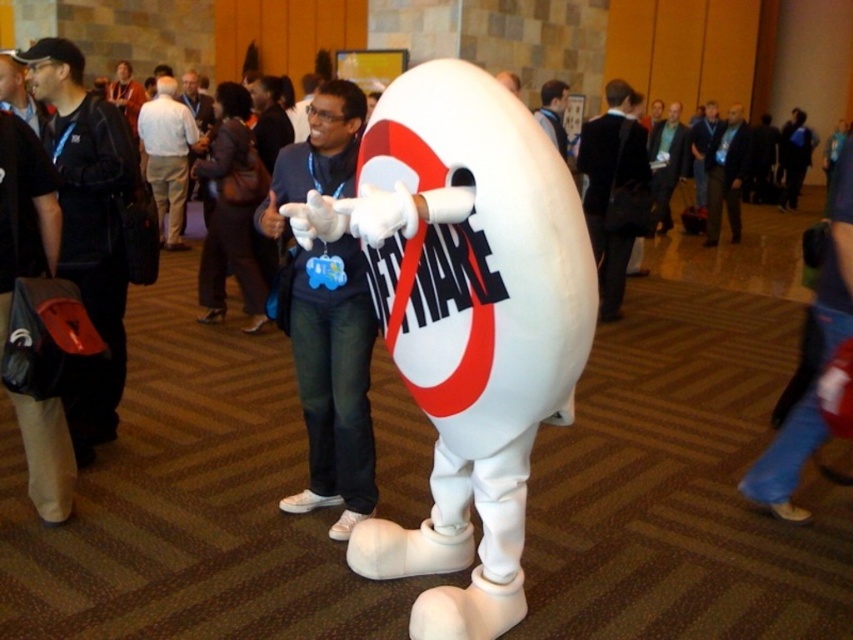
From the picture: You are standing in the conference hall and see two points marked in the scene. Which point is closer to you, point (334, 336) or point (723, 122)?

Point (334, 336) is closer to the viewer than point (723, 122).

You are standing in the conference hall and see two points marked in the scene. Which point, point (115, 150) or point (660, 227), is nearer to you?

Point (115, 150) is closer to the viewer than point (660, 227).